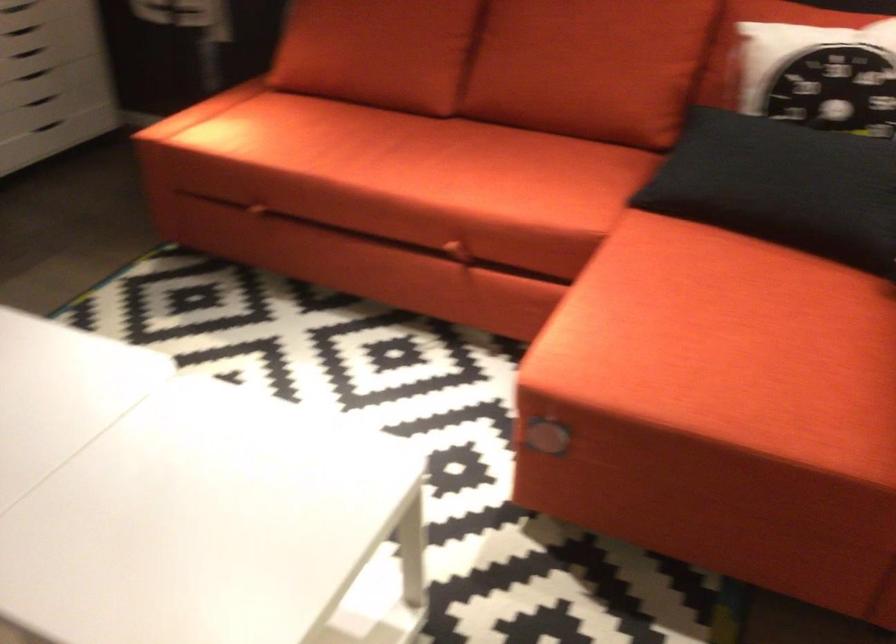
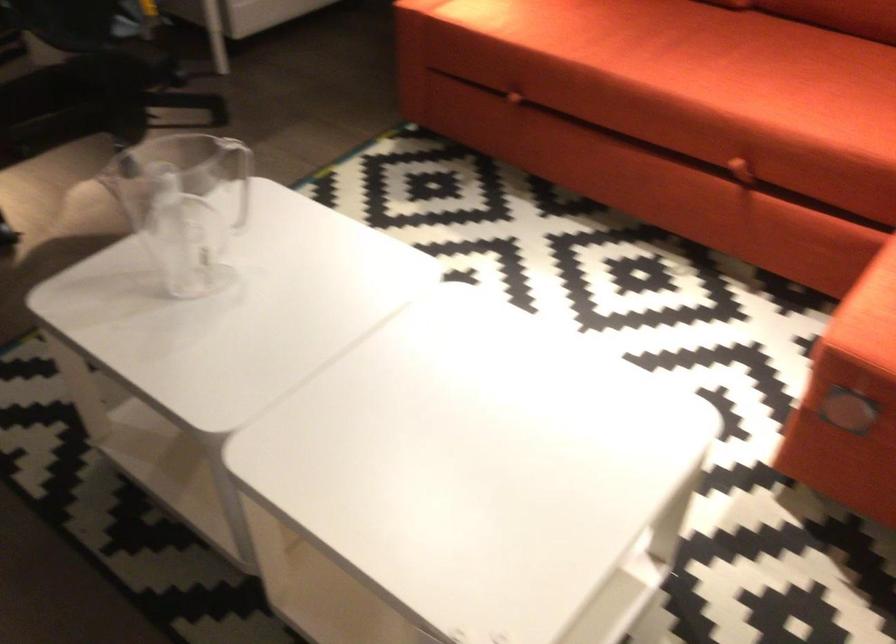
Find the pixel in the second image that matches [407,182] in the first image.

(688, 80)